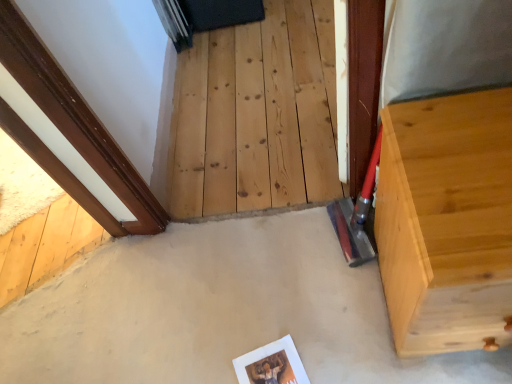
Question: Considering the relative sizes of natural wood stairwell at center and light wood dresser at right in the image provided, is natural wood stairwell at center shorter than light wood dresser at right?

Choices:
 (A) no
 (B) yes

Answer: (B)

Question: Is natural wood stairwell at center bigger than light wood dresser at right?

Choices:
 (A) no
 (B) yes

Answer: (A)

Question: From a real-world perspective, is natural wood stairwell at center under light wood dresser at right?

Choices:
 (A) yes
 (B) no

Answer: (A)

Question: From a real-world perspective, does natural wood stairwell at center stand above light wood dresser at right?

Choices:
 (A) yes
 (B) no

Answer: (B)

Question: Could you tell me if natural wood stairwell at center is facing light wood dresser at right?

Choices:
 (A) yes
 (B) no

Answer: (B)

Question: From a real-world perspective, is smooth concrete at center physically located above or below light wood dresser at right?

Choices:
 (A) below
 (B) above

Answer: (A)

Question: Considering the relative positions of smooth concrete at center and light wood dresser at right in the image provided, is smooth concrete at center to the left or to the right of light wood dresser at right?

Choices:
 (A) right
 (B) left

Answer: (B)

Question: From the image's perspective, is smooth concrete at center located above or below light wood dresser at right?

Choices:
 (A) above
 (B) below

Answer: (B)

Question: In terms of width, does smooth concrete at center look wider or thinner when compared to light wood dresser at right?

Choices:
 (A) wide
 (B) thin

Answer: (A)

Question: Is light wood dresser at right to the left or to the right of smooth concrete at center in the image?

Choices:
 (A) right
 (B) left

Answer: (A)

Question: From a real-world perspective, is light wood dresser at right positioned above or below smooth concrete at center?

Choices:
 (A) below
 (B) above

Answer: (B)

Question: From the image's perspective, is light wood dresser at right located above or below smooth concrete at center?

Choices:
 (A) above
 (B) below

Answer: (A)

Question: Is light wood dresser at right inside or outside of smooth concrete at center?

Choices:
 (A) inside
 (B) outside

Answer: (B)

Question: In terms of height, does light wood dresser at right look taller or shorter compared to natural wood stairwell at center?

Choices:
 (A) tall
 (B) short

Answer: (A)

Question: Is point (501, 231) positioned closer to the camera than point (298, 163)?

Choices:
 (A) farther
 (B) closer

Answer: (B)